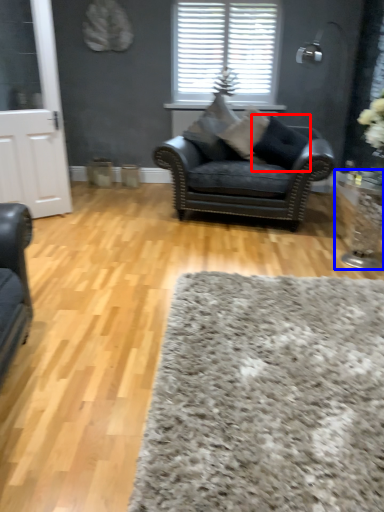
Question: Which object is closer to the camera taking this photo, pillow (highlighted by a red box) or side table (highlighted by a blue box)?

Choices:
 (A) pillow
 (B) side table

Answer: (B)